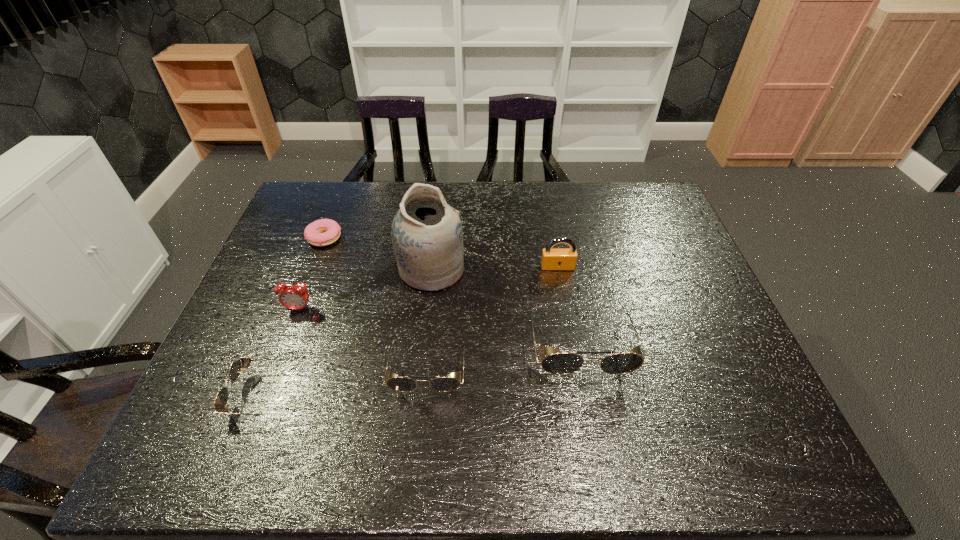
In the image, there is a desktop. Identify the location of free space at the far edge. (351, 215).

The image size is (960, 540). Find the location of `vacant space at the near edge of the desktop`. vacant space at the near edge of the desktop is located at coordinates (634, 396).

In order to click on vacant area at the left edge in this screenshot , I will do `click(295, 248)`.

In the image, there is a desktop. Identify the location of vacant space at the right edge. (639, 231).

In the image, there is a desktop. Identify the location of vacant area at the far left corner. (326, 204).

Locate an element on the screen. vacant region at the far right corner is located at coordinates (623, 197).

Where is `free area in between the padlock and the shortest sunglasses`? This screenshot has width=960, height=540. free area in between the padlock and the shortest sunglasses is located at coordinates 410,331.

Find the location of a particular element. free space between the alarm clock and the tallest object is located at coordinates (365, 289).

Where is `blank region between the tallest object and the third shortest object`? The height and width of the screenshot is (540, 960). blank region between the tallest object and the third shortest object is located at coordinates (430, 319).

The image size is (960, 540). I want to click on free spot between the third shortest object and the padlock, so click(x=492, y=318).